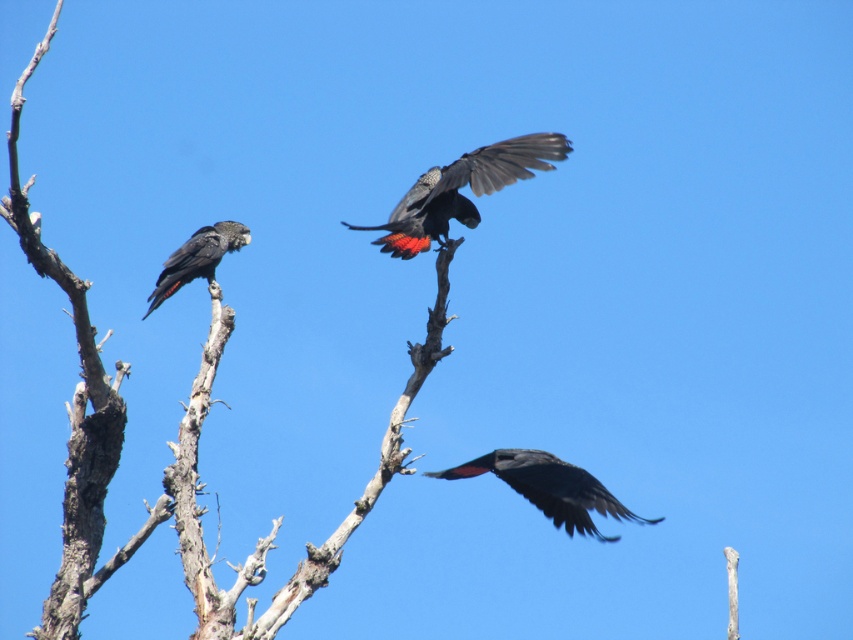
Question: Is matte black bird at center smaller than matte black parrot at left?

Choices:
 (A) yes
 (B) no

Answer: (A)

Question: Can you confirm if shiny black bird at center is positioned above matte black parrot at left?

Choices:
 (A) no
 (B) yes

Answer: (B)

Question: Which of the following is the closest to the observer?

Choices:
 (A) matte black bird at center
 (B) matte black parrot at left
 (C) shiny black bird at center

Answer: (C)

Question: Which of the following is the closest to the observer?

Choices:
 (A) (152, 308)
 (B) (544, 490)
 (C) (486, 189)

Answer: (C)

Question: Which is nearer to the matte black bird at center?

Choices:
 (A) shiny black bird at center
 (B) matte black parrot at left

Answer: (A)

Question: Does shiny black bird at center have a greater width compared to matte black parrot at left?

Choices:
 (A) yes
 (B) no

Answer: (A)